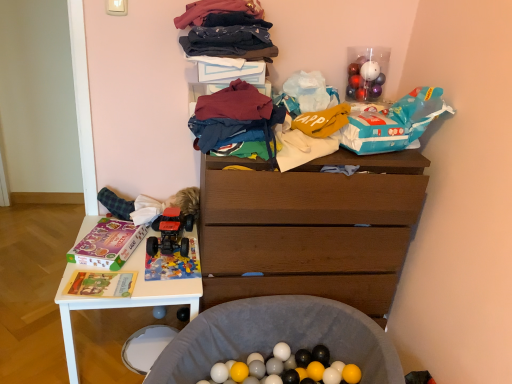
In order to click on blank space above maroon fabric at center, acting as the first clothing starting from the bottom (from a real-world perspective) in this screenshot , I will do `click(236, 105)`.